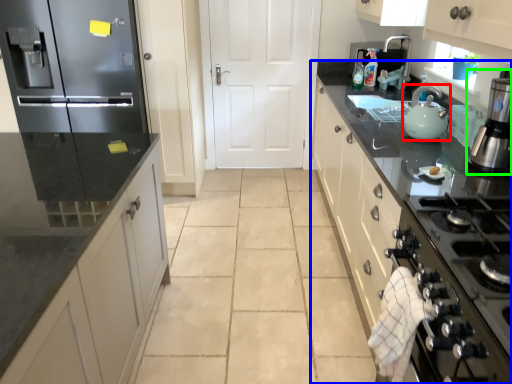
Question: Considering the real-world distances, which object is closest to kitchen appliance (highlighted by a red box)? countertop (highlighted by a blue box) or home appliance (highlighted by a green box).

Choices:
 (A) countertop
 (B) home appliance

Answer: (B)